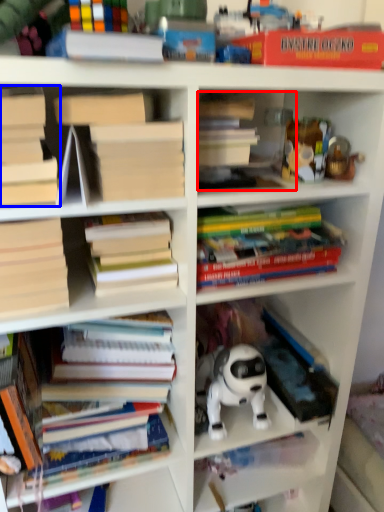
Question: Which object is closer to the camera taking this photo, book (highlighted by a red box) or book (highlighted by a blue box)?

Choices:
 (A) book
 (B) book

Answer: (B)